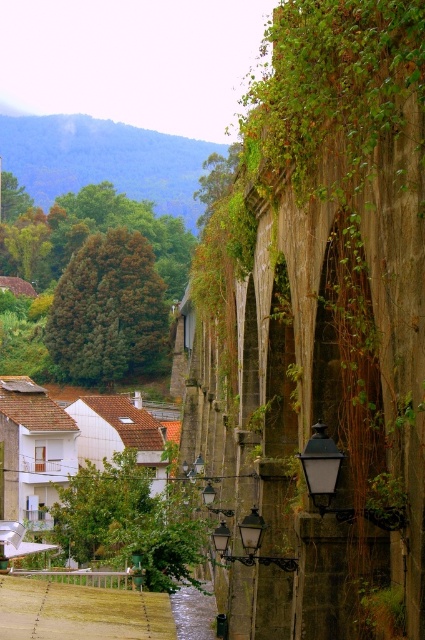
Is blue-green vegetation at upper left bigger than green leafy ivy at center?

Yes.

Is the position of blue-green vegetation at upper left more distant than that of green leafy ivy at center?

Yes, it is.

You are a GUI agent. You are given a task and a screenshot of the screen. Output one action in this format:
    pyautogui.click(x=<x>, y=<y>)
    Task: Click on the blue-green vegetation at upper left
    The height and width of the screenshot is (640, 425).
    Given the screenshot: What is the action you would take?
    pyautogui.click(x=104, y=161)

Looking at this image, who is more distant from viewer, (113, 355) or (36, 518)?

The point (113, 355) is behind.

Is green leafy ivy at center above white matte house at lower left?

Yes.

Identify the location of green leafy ivy at center. The height and width of the screenshot is (640, 425). (107, 310).

From the picture: Does blue-green vegetation at upper left have a greater height compared to white matte house at lower left?

Yes.

I want to click on blue-green vegetation at upper left, so click(104, 161).